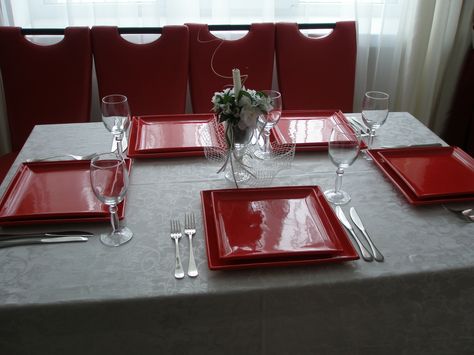
Locate an element on the screen. wineglasses is located at coordinates (108, 186), (117, 105), (277, 100), (358, 139), (382, 112).